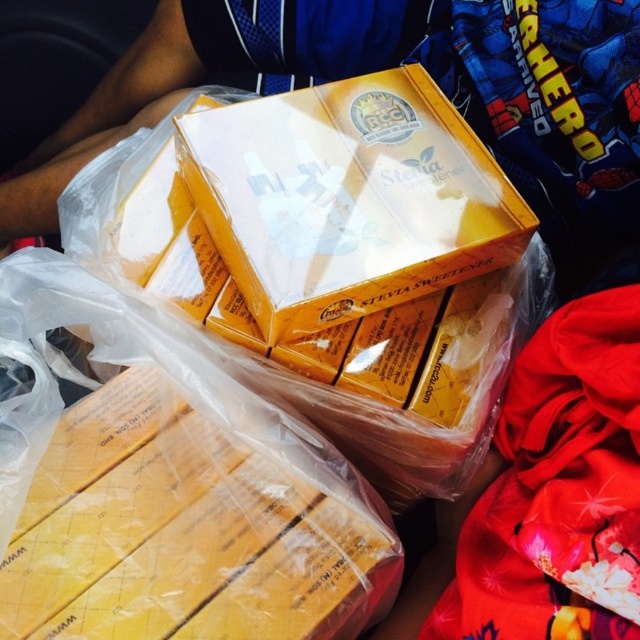
Can you confirm if yellow cardboard box at lower left is positioned above yellow cardboard box at center?

Actually, yellow cardboard box at lower left is below yellow cardboard box at center.

Who is positioned more to the right, yellow cardboard box at lower left or yellow cardboard box at center?

From the viewer's perspective, yellow cardboard box at center appears more on the right side.

This screenshot has height=640, width=640. Find the location of `yellow cardboard box at lower left`. yellow cardboard box at lower left is located at coordinates [x=188, y=532].